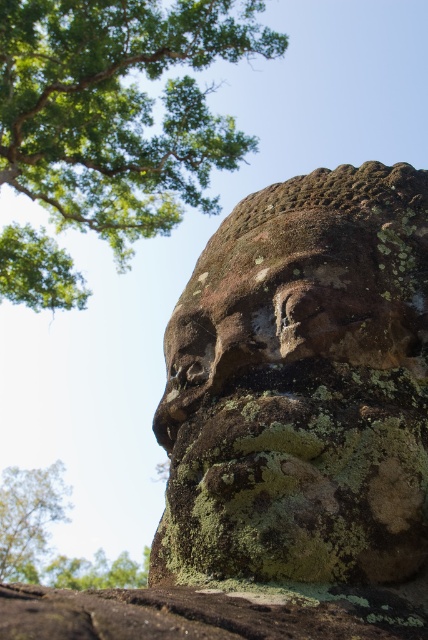
Is point (196, 333) more distant than point (11, 579)?

No, (196, 333) is closer to viewer.

Who is more distant from viewer, (x=265, y=252) or (x=5, y=561)?

Positioned behind is point (x=5, y=561).

Which is in front, point (222, 339) or point (8, 512)?

Point (222, 339)

At what (x,y) coordinates should I click in order to perform the action: click on rusty stone face at center. Please return your answer as a coordinate pair (x, y). Looking at the image, I should click on [x=288, y=300].

Is green mossy rock at upper left above green mossy tree at upper left?

Yes.

Who is more forward, (21,186) or (11,576)?

Positioned in front is point (21,186).

The image size is (428, 640). I want to click on green mossy rock at upper left, so click(x=118, y=108).

Who is positioned more to the right, green mossy stone face at center or rusty stone face at center?

rusty stone face at center

The width and height of the screenshot is (428, 640). Identify the location of green mossy stone face at center. (300, 387).